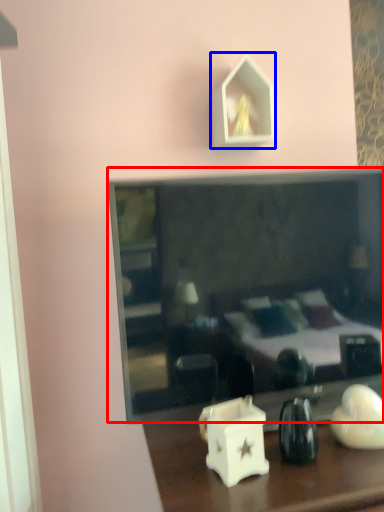
Question: Which of the following is the closest to the observer, mirror (highlighted by a red box) or picture frame (highlighted by a blue box)?

Choices:
 (A) mirror
 (B) picture frame

Answer: (A)